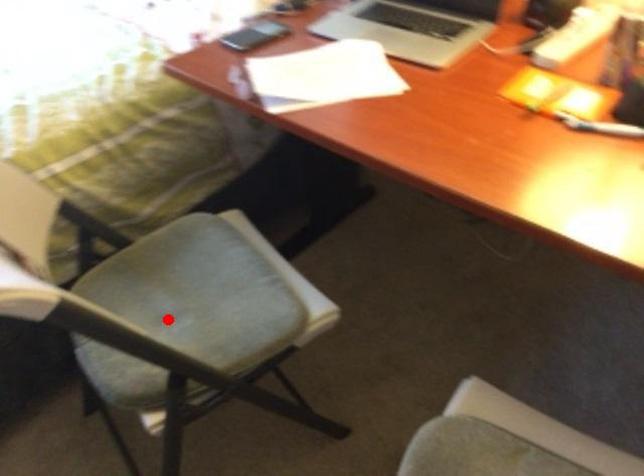
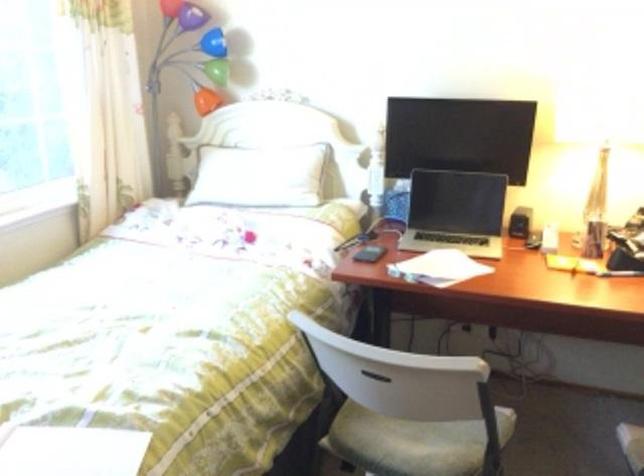
Question: I am providing you with two images of the same scene from different viewpoints. A red point is shown in image1. For the corresponding object point in image2, is it positioned nearer or farther from the camera?

Choices:
 (A) Nearer
 (B) Farther

Answer: (B)